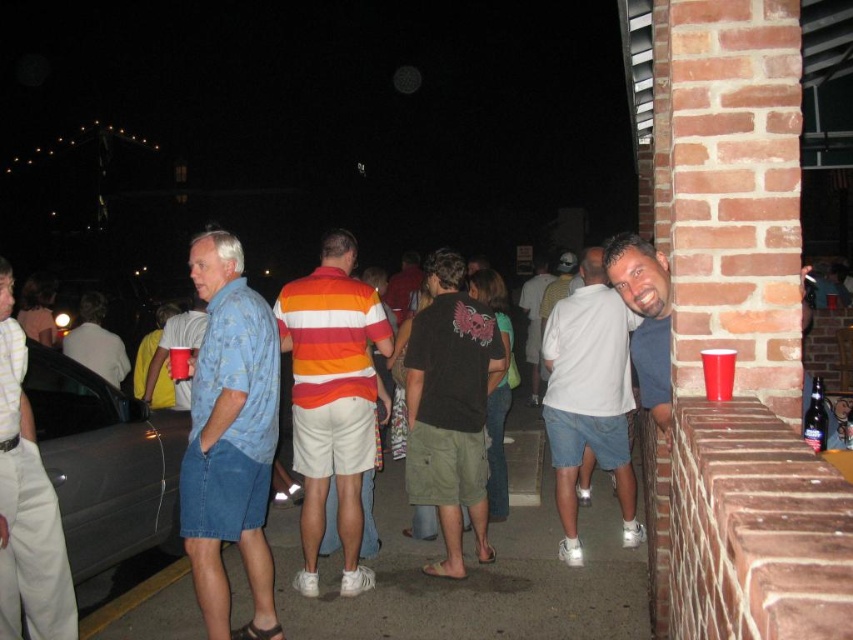
Question: In this image, where is metallic gray car at left located relative to matte blue t-shirt at right?

Choices:
 (A) left
 (B) right

Answer: (A)

Question: Which object is the farthest from the matte white t-shirt at center?

Choices:
 (A) orange striped polo shirt at center
 (B) brushed metal shirt at left

Answer: (B)

Question: Which point is closer to the camera taking this photo?

Choices:
 (A) (323, 374)
 (B) (531, 371)
 (C) (433, 372)

Answer: (A)

Question: Observing the image, what is the correct spatial positioning of metallic gray car at left in reference to orange striped polo shirt at center?

Choices:
 (A) right
 (B) left

Answer: (B)

Question: From the image, what is the correct spatial relationship of blue denim shorts at left in relation to brushed metal shirt at left?

Choices:
 (A) left
 (B) right

Answer: (B)

Question: Which point is farther to the camera?

Choices:
 (A) (74, 484)
 (B) (32, 461)
 (C) (548, 323)
 (D) (527, 340)

Answer: (D)